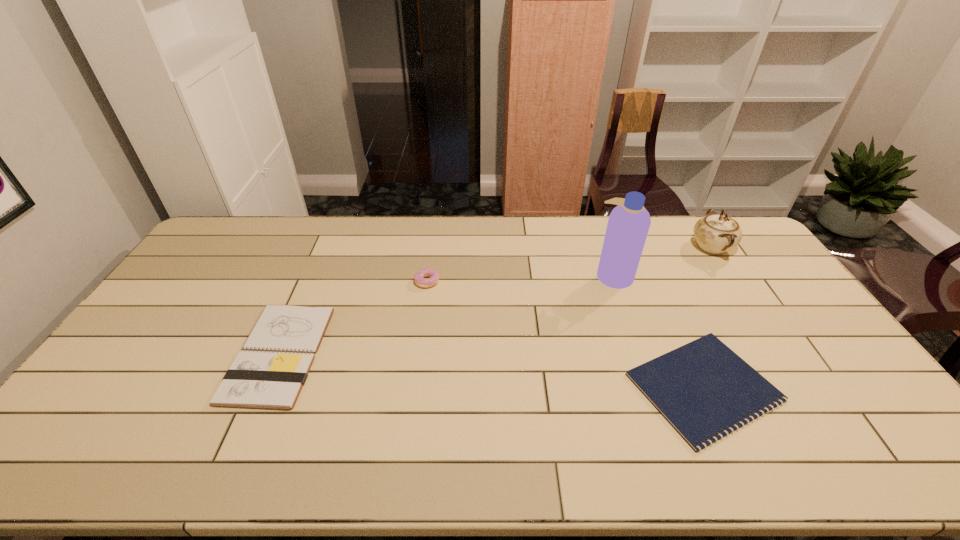
Where is `free space between the shampoo and the doughnut`? Image resolution: width=960 pixels, height=540 pixels. free space between the shampoo and the doughnut is located at coordinates (520, 278).

Locate an element on the screen. The width and height of the screenshot is (960, 540). the closest object to the shorter notepad is located at coordinates (628, 224).

Identify which object is the closest to the shampoo. Please provide its 2D coordinates. Your answer should be formatted as a tuple, i.e. [(x, y)], where the tuple contains the x and y coordinates of a point satisfying the conditions above.

[(703, 389)]

You are a GUI agent. You are given a task and a screenshot of the screen. Output one action in this format:
    pyautogui.click(x=<x>, y=<y>)
    Task: Click on the free space that satisfies the following two spatial constraints: 1. on the back side of the chinaware; 2. on the left side of the second object from left to right
    The height and width of the screenshot is (540, 960).
    Given the screenshot: What is the action you would take?
    pyautogui.click(x=432, y=247)

I want to click on free location that satisfies the following two spatial constraints: 1. on the back side of the shampoo; 2. on the left side of the chinaware, so click(603, 247).

At what (x,y) coordinates should I click in order to perform the action: click on vacant space that satisfies the following two spatial constraints: 1. on the front side of the right notepad; 2. on the left side of the third shortest object. Please return your answer as a coordinate pair (x, y). The height and width of the screenshot is (540, 960). Looking at the image, I should click on coord(413,387).